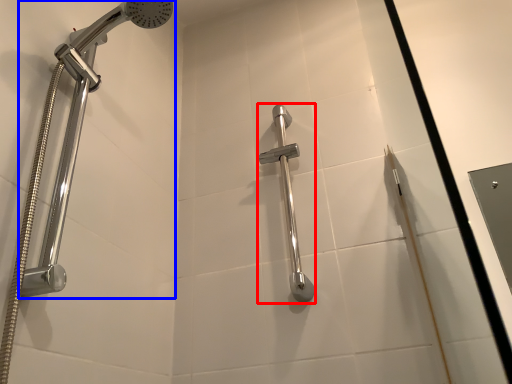
Question: Among these objects, which one is nearest to the camera, shower (highlighted by a red box) or shower (highlighted by a blue box)?

Choices:
 (A) shower
 (B) shower

Answer: (B)